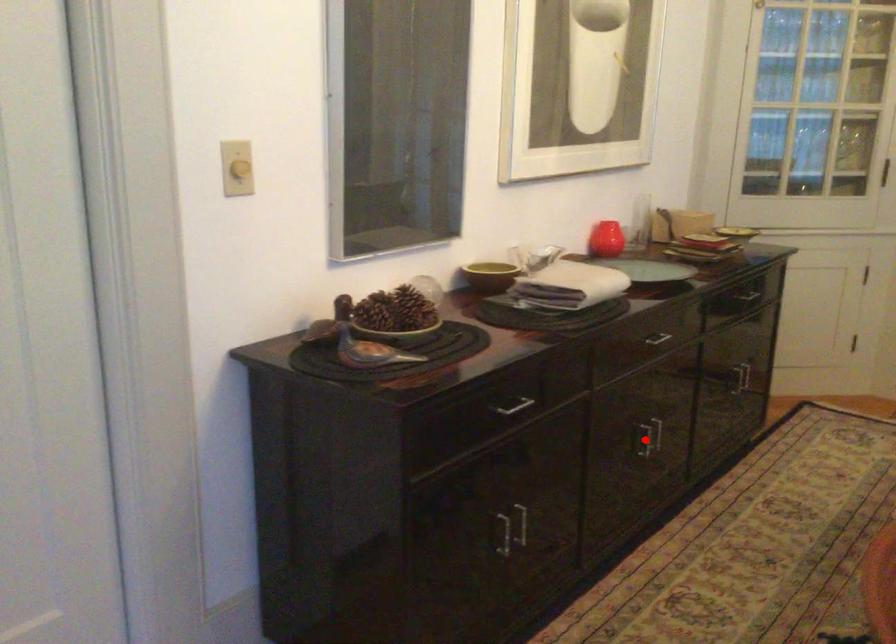
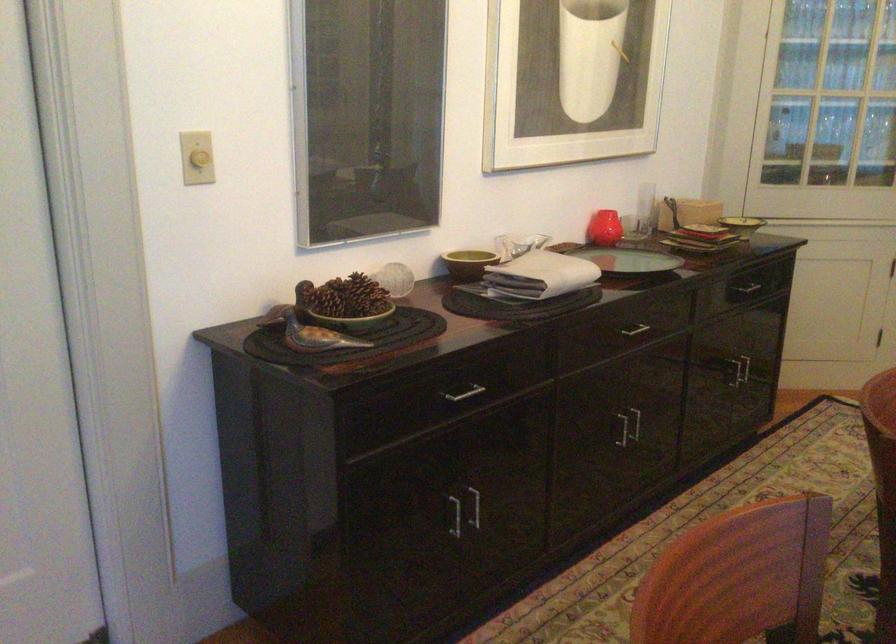
Where in the second image is the point corresponding to the highlighted location from the first image?

(623, 429)